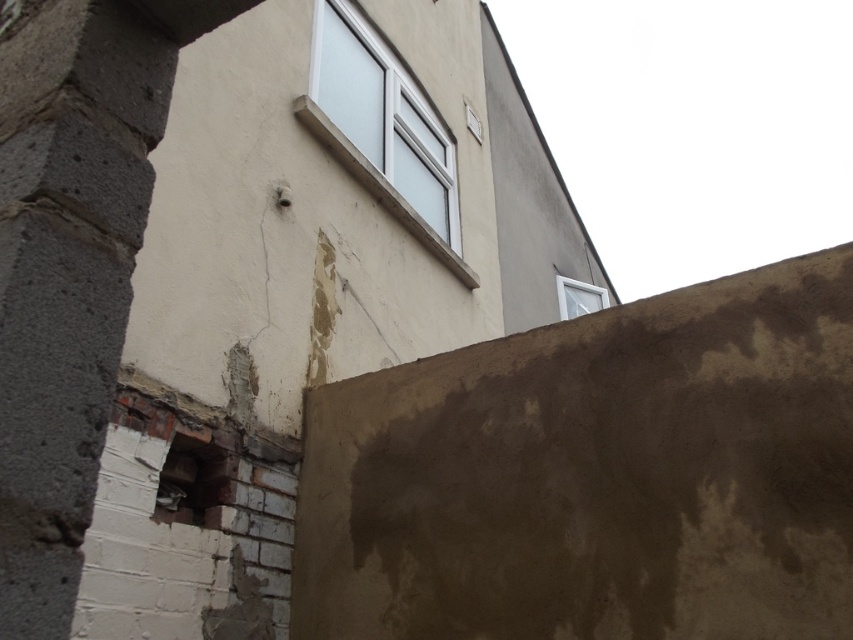
You are an architect inspecting the building facade. You notice the white frosted glass window at upper center and the white plastic window at upper right. Which window has a larger width?

The white frosted glass window at upper center might be wider than the white plastic window at upper right according to the description.

You are an architect inspecting the building facade. You notice two windows, the white frosted glass window at upper center and the white plastic window at upper right. Which window is located higher up on the building facade?

The white frosted glass window at upper center is positioned higher up on the building facade than the white plastic window at upper right.

You are standing in front of a construction site and see the white frosted glass window at upper center. You want to take a photo of it with your camera, which has a maximum focus range of 8 feet. Can you capture the window clearly without moving closer?

The white frosted glass window at upper center and camera are 8.72 feet apart. Since the camera can only focus up to 8 feet, the distance is too far, so you cannot capture the window clearly without moving closer.